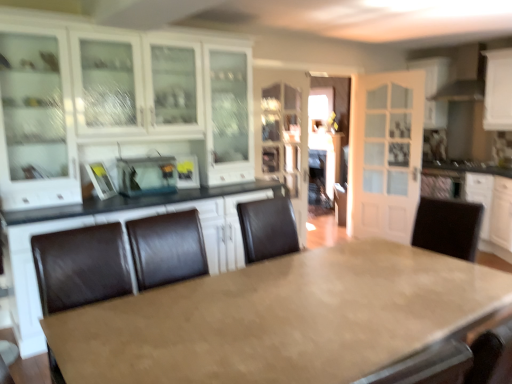
Question: Is point (184, 160) positioned closer to the camera than point (147, 185)?

Choices:
 (A) closer
 (B) farther

Answer: (B)

Question: Is matte black toaster at center, which is the first appliance in right-to-left order, spatially inside metallic silver toaster at center, the second appliance in the right-to-left sequence, or outside of it?

Choices:
 (A) outside
 (B) inside

Answer: (A)

Question: Estimate the real-world distances between objects in this image. Which object is closer to the matte glass cabinet at center, which appears as the third cabinetry when viewed from the right?

Choices:
 (A) white glass door at upper right
 (B) white glossy cabinet at upper left, which is the fourth cabinetry from right to left
 (C) white glossy cabinet at upper right, which is counted as the 1th cabinetry, starting from the right
 (D) metallic silver toaster at center, the second appliance in the right-to-left sequence
 (E) matte brown table at center

Answer: (B)

Question: Considering the real-world distances, which object is closest to the white glossy cabinet at upper left, which is the fourth cabinetry from right to left?

Choices:
 (A) metallic silver toaster at center, the second appliance in the right-to-left sequence
 (B) matte black toaster at center, which is the 2th appliance from left to right
 (C) matte brown table at center
 (D) white glossy cabinet at upper right, which appears as the 4th cabinetry when viewed from the left
 (E) white glass door at upper right

Answer: (A)